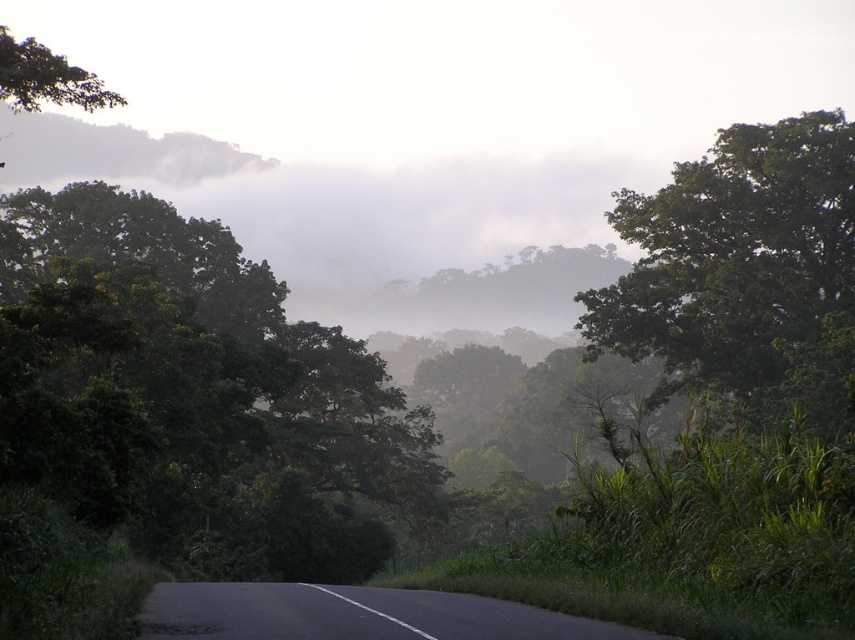
Can you confirm if green leafy tree at left is thinner than green leafy tree at upper left?

Yes, green leafy tree at left is thinner than green leafy tree at upper left.

Between green leafy tree at left and green leafy tree at upper left, which one has more height?

With more height is green leafy tree at upper left.

Is point (171, 352) in front of point (7, 77)?

No, it is behind (7, 77).

The image size is (855, 640). What are the coordinates of `green leafy tree at left` in the screenshot? It's located at (195, 396).

Does green leafy tree at left have a greater height compared to green leafy tree at upper right?

Yes.

Who is lower down, green leafy tree at left or green leafy tree at upper right?

green leafy tree at left

Find the location of a particular element. green leafy tree at left is located at coordinates (195, 396).

Locate an element on the screen. green leafy tree at left is located at coordinates (195, 396).

Between green leafy tree at upper right and green leafy tree at upper left, which one appears on the right side from the viewer's perspective?

Positioned to the right is green leafy tree at upper right.

Is point (845, 120) positioned before point (60, 70)?

No, (845, 120) is further to viewer.

Is point (753, 300) in front of point (75, 67)?

That is True.

I want to click on green leafy tree at upper right, so click(x=743, y=272).